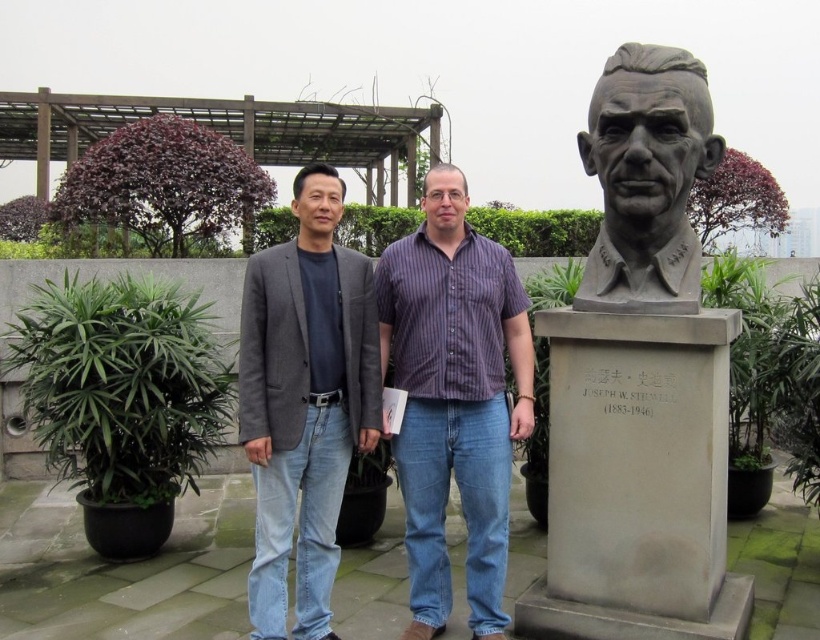
Question: Which point is closer to the camera taking this photo?

Choices:
 (A) pos(682,99)
 (B) pos(358,253)
 (C) pos(608,74)

Answer: (A)

Question: Can you confirm if purple striped shirt at center is positioned to the left of bronze bust at right?

Choices:
 (A) no
 (B) yes

Answer: (B)

Question: Which of the following is the farthest from the observer?

Choices:
 (A) gray wool blazer at center
 (B) purple striped shirt at center
 (C) gray stone bust at right
 (D) bronze bust at right

Answer: (B)

Question: Which object is positioned farthest from the bronze bust at right?

Choices:
 (A) gray wool blazer at center
 (B) purple striped shirt at center
 (C) gray stone bust at right

Answer: (A)

Question: Is gray stone bust at right wider than bronze bust at right?

Choices:
 (A) yes
 (B) no

Answer: (A)

Question: Is gray stone bust at right in front of bronze bust at right?

Choices:
 (A) no
 (B) yes

Answer: (B)